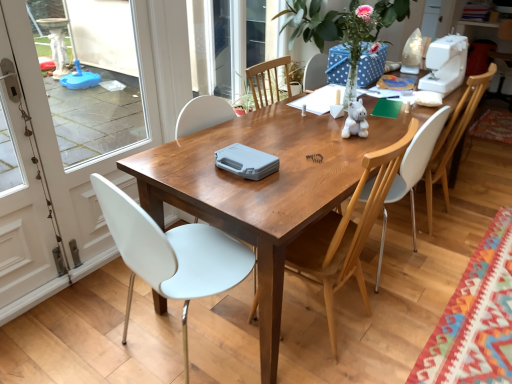
I want to click on vacant space to the right of wooden chair at center, the third chair viewed from the right, so click(405, 315).